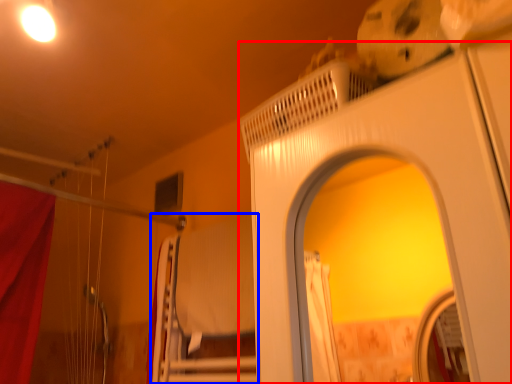
Question: Which object is further to the camera taking this photo, screen door (highlighted by a red box) or bed (highlighted by a blue box)?

Choices:
 (A) screen door
 (B) bed

Answer: (B)